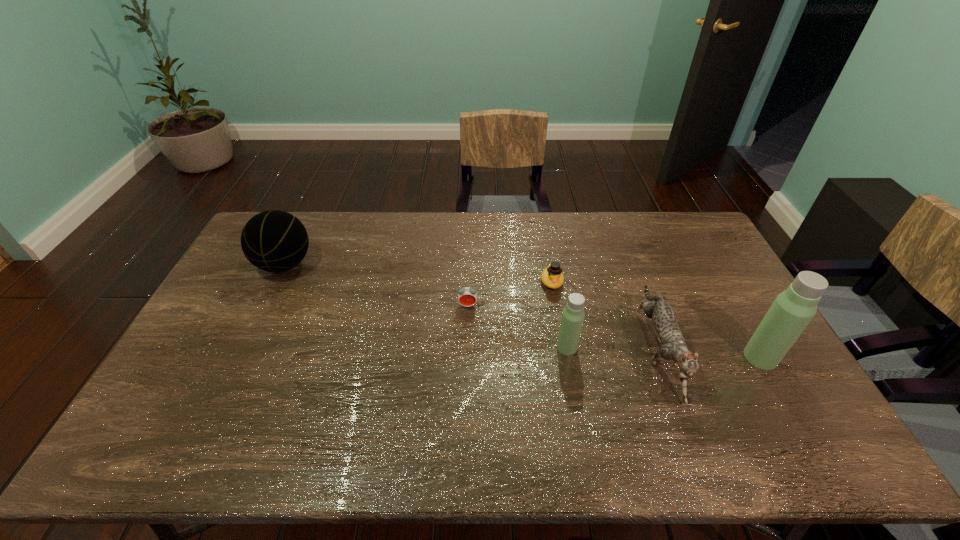
Find the location of a particular element. the left thermos bottle is located at coordinates (573, 315).

I want to click on the right thermos bottle, so coord(792,310).

Find the location of a particular element. This screenshot has height=540, width=960. the tallest object is located at coordinates (792, 310).

Locate an element on the screen. The height and width of the screenshot is (540, 960). basketball is located at coordinates (275, 241).

This screenshot has height=540, width=960. What are the coordinates of `duck` in the screenshot? It's located at (552, 277).

Locate an element on the screen. This screenshot has height=540, width=960. alarm clock is located at coordinates (467, 296).

Locate an element on the screen. The image size is (960, 540). the fourth tallest object is located at coordinates (673, 346).

Find the location of `cat`. cat is located at coordinates (673, 346).

I want to click on free space located 0.100m on the right of the left thermos bottle, so click(612, 347).

The height and width of the screenshot is (540, 960). In order to click on vacant region located 0.290m on the left of the rightmost object in this screenshot , I will do `click(641, 357)`.